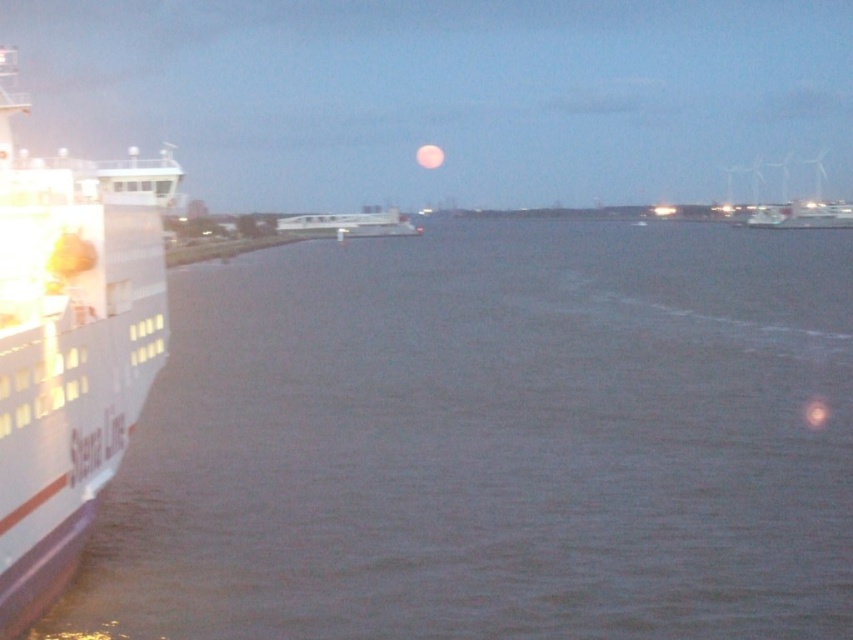
Can you confirm if dark blue water at left is smaller than white glossy cruise ship at left?

Yes, dark blue water at left is smaller than white glossy cruise ship at left.

Does point (621, 547) lie in front of point (131, 156)?

Yes, it is in front of point (131, 156).

Where is `dark blue water at left`? dark blue water at left is located at coordinates (492, 442).

Who is shorter, dark blue water at left or white matte boat at center?

dark blue water at left

Is dark blue water at left in front of white matte boat at center?

Yes, it is.

This screenshot has width=853, height=640. I want to click on dark blue water at left, so click(x=492, y=442).

How far apart are white glossy cruise ship at left and white matte boat at center?

white glossy cruise ship at left is 82.44 meters from white matte boat at center.

Does white glossy cruise ship at left appear over white matte boat at center?

Yes, white glossy cruise ship at left is above white matte boat at center.

At what (x,y) coordinates should I click in order to perform the action: click on white glossy cruise ship at left. Please return your answer as a coordinate pair (x, y). Looking at the image, I should click on (68, 344).